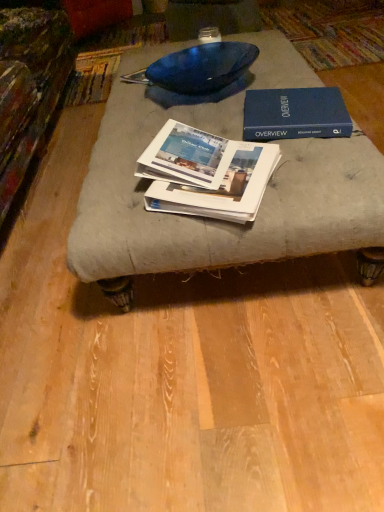
Measure the distance between white paper booklet at center, which is the second book in top-to-bottom order, and camera.

The distance of white paper booklet at center, which is the second book in top-to-bottom order, from camera is 38.03 inches.

What do you see at coordinates (186, 156) in the screenshot?
I see `white paper booklet at center, which is the second book in top-to-bottom order` at bounding box center [186, 156].

The width and height of the screenshot is (384, 512). I want to click on white glossy book at center, marked as the third book in a top-to-bottom arrangement, so click(222, 188).

Considering the positions of objects blue hardcover book at upper right, the 3th book in the bottom-to-top sequence, and white paper booklet at center, positioned as the 2th book in bottom-to-top order, in the image provided, who is in front, blue hardcover book at upper right, the 3th book in the bottom-to-top sequence, or white paper booklet at center, positioned as the 2th book in bottom-to-top order,?

white paper booklet at center, positioned as the 2th book in bottom-to-top order, is more forward.

Is blue hardcover book at upper right, which is counted as the first book, starting from the top, thinner than white paper booklet at center, positioned as the 2th book in bottom-to-top order?

In fact, blue hardcover book at upper right, which is counted as the first book, starting from the top, might be wider than white paper booklet at center, positioned as the 2th book in bottom-to-top order.

Is blue hardcover book at upper right, the 3th book in the bottom-to-top sequence, bigger or smaller than white paper booklet at center, positioned as the 2th book in bottom-to-top order?

Clearly, blue hardcover book at upper right, the 3th book in the bottom-to-top sequence, is larger in size than white paper booklet at center, positioned as the 2th book in bottom-to-top order.

Between white glossy book at center, marked as the third book in a top-to-bottom arrangement, and white paper booklet at center, which is the second book in top-to-bottom order, which one has less height?

With less height is white glossy book at center, marked as the third book in a top-to-bottom arrangement.

Visually, is white glossy book at center, the 1th book ordered from the bottom, positioned to the left or to the right of white paper booklet at center, which is the second book in top-to-bottom order?

Based on their positions, white glossy book at center, the 1th book ordered from the bottom, is located to the right of white paper booklet at center, which is the second book in top-to-bottom order.

Does white glossy book at center, the 1th book ordered from the bottom, contain white paper booklet at center, which is the second book in top-to-bottom order?

No.

Measure the distance between white glossy book at center, marked as the third book in a top-to-bottom arrangement, and white paper booklet at center, positioned as the 2th book in bottom-to-top order.

The distance of white glossy book at center, marked as the third book in a top-to-bottom arrangement, from white paper booklet at center, positioned as the 2th book in bottom-to-top order, is 2.64 inches.

From the image's perspective, is white paper booklet at center, positioned as the 2th book in bottom-to-top order, under blue hardcover book at upper right, which is counted as the first book, starting from the top?

Yes, from the image's perspective, white paper booklet at center, positioned as the 2th book in bottom-to-top order, is below blue hardcover book at upper right, which is counted as the first book, starting from the top.

Based on the photo, does white paper booklet at center, which is the second book in top-to-bottom order, touch blue hardcover book at upper right, the 3th book in the bottom-to-top sequence?

white paper booklet at center, which is the second book in top-to-bottom order, and blue hardcover book at upper right, the 3th book in the bottom-to-top sequence, are not in contact.

From a real-world perspective, which is physically above, white paper booklet at center, which is the second book in top-to-bottom order, or blue hardcover book at upper right, the 3th book in the bottom-to-top sequence?

In real-world perspective, white paper booklet at center, which is the second book in top-to-bottom order, is above.

Considering the points (247, 192) and (352, 127), which point is in front, point (247, 192) or point (352, 127)?

The point (247, 192) is closer.

Which of these two, white glossy book at center, marked as the third book in a top-to-bottom arrangement, or blue hardcover book at upper right, which is counted as the first book, starting from the top, stands shorter?

With less height is white glossy book at center, marked as the third book in a top-to-bottom arrangement.

Does white glossy book at center, marked as the third book in a top-to-bottom arrangement, appear on the left side of blue hardcover book at upper right, the 3th book in the bottom-to-top sequence?

Yes.

Can you confirm if white glossy book at center, marked as the third book in a top-to-bottom arrangement, is bigger than blue hardcover book at upper right, which is counted as the first book, starting from the top?

No, white glossy book at center, marked as the third book in a top-to-bottom arrangement, is not bigger than blue hardcover book at upper right, which is counted as the first book, starting from the top.

How far apart are blue hardcover book at upper right, which is counted as the first book, starting from the top, and white glossy book at center, the 1th book ordered from the bottom?

9.28 inches.

Is blue hardcover book at upper right, the 3th book in the bottom-to-top sequence, outside of white glossy book at center, marked as the third book in a top-to-bottom arrangement?

Absolutely, blue hardcover book at upper right, the 3th book in the bottom-to-top sequence, is external to white glossy book at center, marked as the third book in a top-to-bottom arrangement.

Does blue hardcover book at upper right, which is counted as the first book, starting from the top, come behind white glossy book at center, the 1th book ordered from the bottom?

Yes, the depth of blue hardcover book at upper right, which is counted as the first book, starting from the top, is greater than that of white glossy book at center, the 1th book ordered from the bottom.

From a real-world perspective, who is located higher, blue hardcover book at upper right, which is counted as the first book, starting from the top, or white glossy book at center, marked as the third book in a top-to-bottom arrangement?

blue hardcover book at upper right, which is counted as the first book, starting from the top.

Between white paper booklet at center, positioned as the 2th book in bottom-to-top order, and white glossy book at center, marked as the third book in a top-to-bottom arrangement, which one has less height?

With less height is white glossy book at center, marked as the third book in a top-to-bottom arrangement.

Measure the distance from white paper booklet at center, positioned as the 2th book in bottom-to-top order, to white glossy book at center, the 1th book ordered from the bottom.

white paper booklet at center, positioned as the 2th book in bottom-to-top order, is 2.64 inches away from white glossy book at center, the 1th book ordered from the bottom.

Based on their sizes in the image, would you say white paper booklet at center, positioned as the 2th book in bottom-to-top order, is bigger or smaller than white glossy book at center, the 1th book ordered from the bottom?

white paper booklet at center, positioned as the 2th book in bottom-to-top order, is smaller than white glossy book at center, the 1th book ordered from the bottom.

Considering the positions of objects white paper booklet at center, which is the second book in top-to-bottom order, and white glossy book at center, marked as the third book in a top-to-bottom arrangement, in the image provided, who is behind, white paper booklet at center, which is the second book in top-to-bottom order, or white glossy book at center, marked as the third book in a top-to-bottom arrangement,?

white paper booklet at center, which is the second book in top-to-bottom order, is more distant.

Where is `book that appears behind the white paper booklet at center, which is the second book in top-to-bottom order`? Image resolution: width=384 pixels, height=512 pixels. book that appears behind the white paper booklet at center, which is the second book in top-to-bottom order is located at coordinates (295, 114).

Image resolution: width=384 pixels, height=512 pixels. There is a white glossy book at center, marked as the third book in a top-to-bottom arrangement. What are the coordinates of `the 1st book above it (from the image's perspective)` in the screenshot? It's located at (186, 156).

Looking at the image, which one is located further to white glossy book at center, marked as the third book in a top-to-bottom arrangement, white paper booklet at center, which is the second book in top-to-bottom order, or blue hardcover book at upper right, which is counted as the first book, starting from the top?

Based on the image, blue hardcover book at upper right, which is counted as the first book, starting from the top, appears to be further to white glossy book at center, marked as the third book in a top-to-bottom arrangement.

Based on the photo, which object lies nearer to the anchor point white paper booklet at center, which is the second book in top-to-bottom order, white glossy book at center, the 1th book ordered from the bottom, or blue hardcover book at upper right, the 3th book in the bottom-to-top sequence?

The object closer to white paper booklet at center, which is the second book in top-to-bottom order, is white glossy book at center, the 1th book ordered from the bottom.

Estimate the real-world distances between objects in this image. Which object is closer to blue hardcover book at upper right, the 3th book in the bottom-to-top sequence, white glossy book at center, the 1th book ordered from the bottom, or white paper booklet at center, which is the second book in top-to-bottom order?

Among the two, white paper booklet at center, which is the second book in top-to-bottom order, is located nearer to blue hardcover book at upper right, the 3th book in the bottom-to-top sequence.

When comparing their distances from white paper booklet at center, positioned as the 2th book in bottom-to-top order, does blue hardcover book at upper right, which is counted as the first book, starting from the top, or white glossy book at center, marked as the third book in a top-to-bottom arrangement, seem closer?

white glossy book at center, marked as the third book in a top-to-bottom arrangement.

Looking at the image, which one is located closer to blue hardcover book at upper right, the 3th book in the bottom-to-top sequence, white paper booklet at center, which is the second book in top-to-bottom order, or white glossy book at center, marked as the third book in a top-to-bottom arrangement?

Among the two, white paper booklet at center, which is the second book in top-to-bottom order, is located nearer to blue hardcover book at upper right, the 3th book in the bottom-to-top sequence.

When comparing their distances from white glossy book at center, marked as the third book in a top-to-bottom arrangement, does blue hardcover book at upper right, which is counted as the first book, starting from the top, or white paper booklet at center, which is the second book in top-to-bottom order, seem further?

Based on the image, blue hardcover book at upper right, which is counted as the first book, starting from the top, appears to be further to white glossy book at center, marked as the third book in a top-to-bottom arrangement.

Identify the location of book between white paper booklet at center, positioned as the 2th book in bottom-to-top order, and blue hardcover book at upper right, the 3th book in the bottom-to-top sequence, in the horizontal direction. [x=222, y=188].